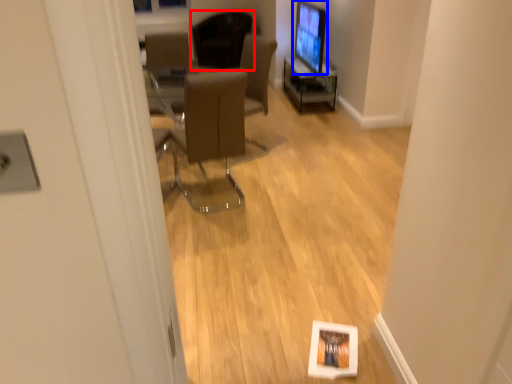
Question: Which object appears farthest to the camera in this image, chair (highlighted by a red box) or computer monitor (highlighted by a blue box)?

Choices:
 (A) chair
 (B) computer monitor

Answer: (A)